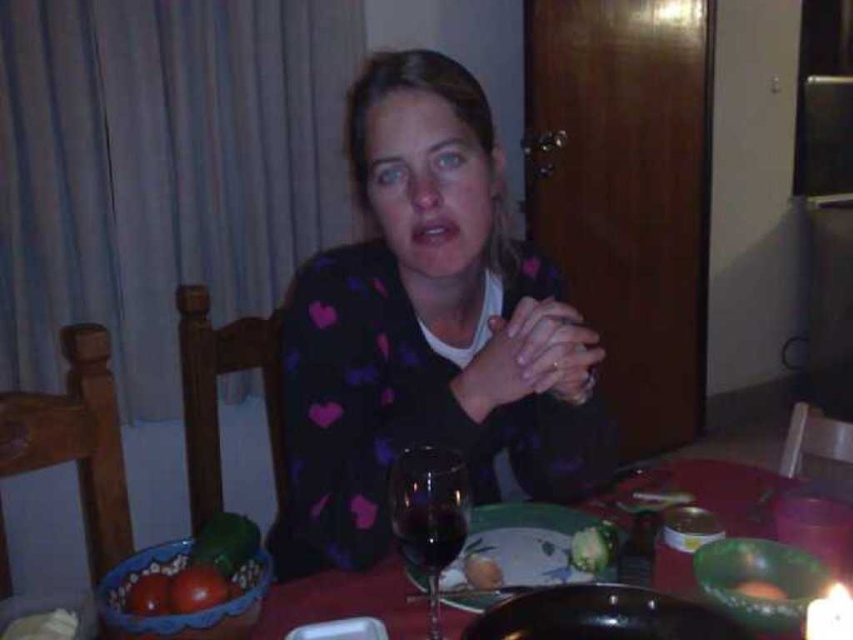
Does black heart-patterned sweater at center have a larger size compared to smooth orange carrot at center?

Yes.

In the scene shown: Can you confirm if black heart-patterned sweater at center is positioned below smooth orange carrot at center?

No.

I want to click on black heart-patterned sweater at center, so click(425, 330).

The width and height of the screenshot is (853, 640). In order to click on black heart-patterned sweater at center in this screenshot , I will do pos(425,330).

Does transparent wax candle at lower right have a greater width compared to green leafy vegetable at center?

Yes, transparent wax candle at lower right is wider than green leafy vegetable at center.

Who is taller, transparent wax candle at lower right or green leafy vegetable at center?

transparent wax candle at lower right is taller.

Where is `transparent wax candle at lower right`? transparent wax candle at lower right is located at coordinates (830, 614).

I want to click on transparent wax candle at lower right, so click(830, 614).

Is transparent glass wine glass at center thinner than green leafy vegetable at center?

No, transparent glass wine glass at center is not thinner than green leafy vegetable at center.

Between transparent glass wine glass at center and green leafy vegetable at center, which one appears on the right side from the viewer's perspective?

Positioned to the right is green leafy vegetable at center.

Where is `transparent glass wine glass at center`? transparent glass wine glass at center is located at coordinates (428, 515).